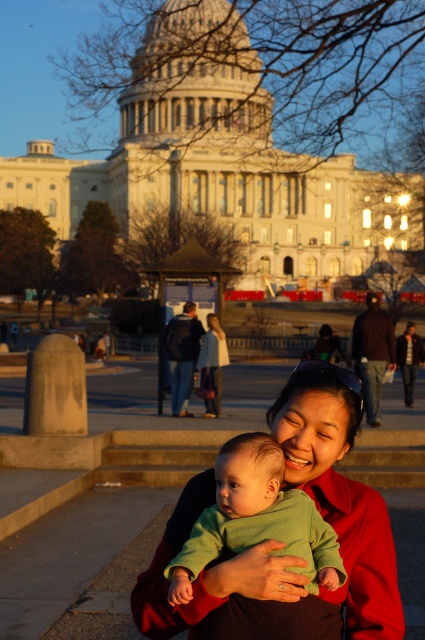
Can you confirm if matte green sweater at center is smaller than green soft baby at center?

No.

Between matte green sweater at center and green soft baby at center, which one is positioned higher?

green soft baby at center

Does point (158, 600) come farther from viewer compared to point (221, 513)?

That is False.

You are a GUI agent. You are given a task and a screenshot of the screen. Output one action in this format:
    pyautogui.click(x=<x>, y=<y>)
    Task: Click on the matte green sweater at center
    
    Given the screenshot: What is the action you would take?
    pyautogui.click(x=280, y=545)